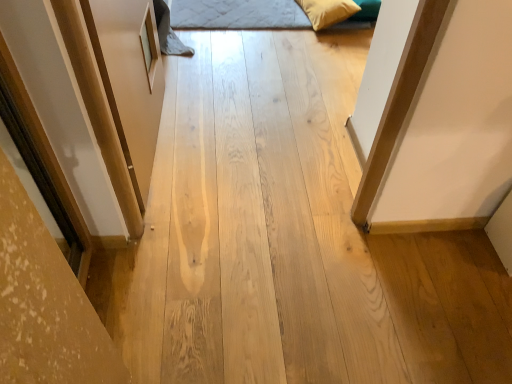
What is the approximate width of velvet yellow pillow at upper right?

velvet yellow pillow at upper right is 12.45 inches wide.

Describe the element at coordinates (327, 11) in the screenshot. I see `velvet yellow pillow at upper right` at that location.

Find the location of a particular element. The width and height of the screenshot is (512, 384). velvet yellow pillow at upper right is located at coordinates (327, 11).

What do you see at coordinates (238, 14) in the screenshot?
I see `quilted fabric bed at upper center` at bounding box center [238, 14].

Find the location of a particular element. The width and height of the screenshot is (512, 384). quilted fabric bed at upper center is located at coordinates tap(238, 14).

Where is `velvet yellow pillow at upper right`? velvet yellow pillow at upper right is located at coordinates click(327, 11).

Can you confirm if velvet yellow pillow at upper right is positioned to the right of quilted fabric bed at upper center?

Yes.

Is velvet yellow pillow at upper right in front of or behind quilted fabric bed at upper center in the image?

Clearly, velvet yellow pillow at upper right is in front of quilted fabric bed at upper center.

Between point (340, 17) and point (199, 4), which one is positioned in front?

The point (340, 17) is in front.

From the image's perspective, which is below, velvet yellow pillow at upper right or quilted fabric bed at upper center?

From the image's view, quilted fabric bed at upper center is below.

From a real-world perspective, which object stands above the other?

A: velvet yellow pillow at upper right.

Considering the relative sizes of velvet yellow pillow at upper right and quilted fabric bed at upper center in the image provided, is velvet yellow pillow at upper right wider than quilted fabric bed at upper center?

Incorrect, the width of velvet yellow pillow at upper right does not surpass that of quilted fabric bed at upper center.

Does velvet yellow pillow at upper right have a greater height compared to quilted fabric bed at upper center?

Indeed, velvet yellow pillow at upper right has a greater height compared to quilted fabric bed at upper center.

Which of these two, velvet yellow pillow at upper right or quilted fabric bed at upper center, is smaller?

velvet yellow pillow at upper right is smaller.

Is velvet yellow pillow at upper right spatially inside quilted fabric bed at upper center, or outside of it?

velvet yellow pillow at upper right cannot be found inside quilted fabric bed at upper center.

Is velvet yellow pillow at upper right beside quilted fabric bed at upper center?

velvet yellow pillow at upper right and quilted fabric bed at upper center are not in contact.

Is velvet yellow pillow at upper right oriented towards quilted fabric bed at upper center?

Yes.

What's the angular difference between velvet yellow pillow at upper right and quilted fabric bed at upper center's facing directions?

There is a 6.86-degree angle between the facing directions of velvet yellow pillow at upper right and quilted fabric bed at upper center.

Locate an element on the screen. Image resolution: width=512 pixels, height=384 pixels. pillow located in front of the quilted fabric bed at upper center is located at coordinates (327, 11).

Is quilted fabric bed at upper center to the right of velvet yellow pillow at upper right from the viewer's perspective?

Incorrect, quilted fabric bed at upper center is not on the right side of velvet yellow pillow at upper right.

Which object is closer to the camera, quilted fabric bed at upper center or velvet yellow pillow at upper right?

Positioned in front is velvet yellow pillow at upper right.

Is point (204, 21) closer to viewer compared to point (336, 20)?

No.

From the image's perspective, which one is positioned lower, quilted fabric bed at upper center or velvet yellow pillow at upper right?

quilted fabric bed at upper center, from the image's perspective.

From a real-world perspective, which is physically above, quilted fabric bed at upper center or velvet yellow pillow at upper right?

In real-world perspective, velvet yellow pillow at upper right is above.

Which of these two, quilted fabric bed at upper center or velvet yellow pillow at upper right, is thinner?

With smaller width is velvet yellow pillow at upper right.

Which of these two, quilted fabric bed at upper center or velvet yellow pillow at upper right, stands shorter?

Standing shorter between the two is quilted fabric bed at upper center.

Can you confirm if quilted fabric bed at upper center is smaller than velvet yellow pillow at upper right?

Incorrect, quilted fabric bed at upper center is not smaller in size than velvet yellow pillow at upper right.

Could velvet yellow pillow at upper right be considered to be inside quilted fabric bed at upper center?

No, velvet yellow pillow at upper right is not inside quilted fabric bed at upper center.

Is quilted fabric bed at upper center directly adjacent to velvet yellow pillow at upper right?

No, quilted fabric bed at upper center is not touching velvet yellow pillow at upper right.

Could you tell me if quilted fabric bed at upper center is turned towards velvet yellow pillow at upper right?

No, quilted fabric bed at upper center is not oriented towards velvet yellow pillow at upper right.

How different are the orientations of quilted fabric bed at upper center and velvet yellow pillow at upper right in degrees?

The facing directions of quilted fabric bed at upper center and velvet yellow pillow at upper right are 6.86 degrees apart.

At what (x,y) coordinates should I click in order to perform the action: click on pillow positioned vertically above the quilted fabric bed at upper center (from a real-world perspective). Please return your answer as a coordinate pair (x, y). The width and height of the screenshot is (512, 384). Looking at the image, I should click on (327, 11).

Locate an element on the screen. The image size is (512, 384). bed below the velvet yellow pillow at upper right (from a real-world perspective) is located at coordinates (238, 14).

Locate an element on the screen. The width and height of the screenshot is (512, 384). bed behind the velvet yellow pillow at upper right is located at coordinates (238, 14).